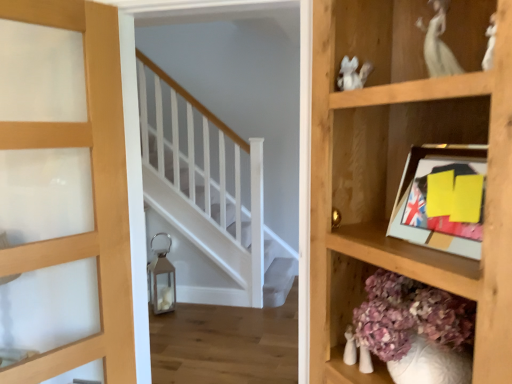
Question: From the image's perspective, is yellow paper picture frame at upper right positioned above or below matte wood door at left?

Choices:
 (A) above
 (B) below

Answer: (A)

Question: Would you say yellow paper picture frame at upper right is to the left or to the right of matte wood door at left in the picture?

Choices:
 (A) left
 (B) right

Answer: (B)

Question: Which object is the farthest from the yellow paper picture frame at upper right?

Choices:
 (A) matte wood door at left
 (B) wooden shelf at right

Answer: (A)

Question: Which object is the farthest from the matte wood door at left?

Choices:
 (A) yellow paper picture frame at upper right
 (B) wooden shelf at right

Answer: (A)